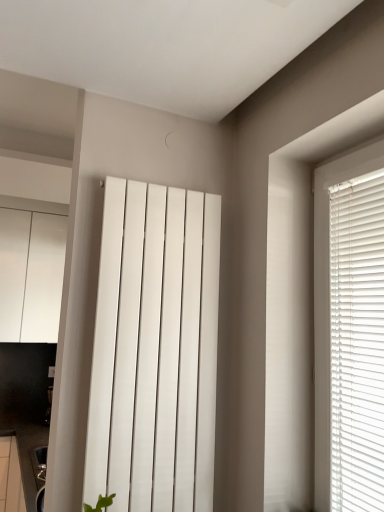
This screenshot has width=384, height=512. What do you see at coordinates (155, 350) in the screenshot?
I see `white smooth radiator at center` at bounding box center [155, 350].

The image size is (384, 512). I want to click on white smooth radiator at center, so click(x=155, y=350).

The width and height of the screenshot is (384, 512). Identify the location of white glossy cabinet at left. (31, 275).

This screenshot has width=384, height=512. Describe the element at coordinates (31, 275) in the screenshot. I see `white glossy cabinet at left` at that location.

Image resolution: width=384 pixels, height=512 pixels. Identify the location of white smooth radiator at center. (155, 350).

Which is more to the right, white glossy cabinet at left or white smooth radiator at center?

white smooth radiator at center is more to the right.

Considering the relative positions of white glossy cabinet at left and white smooth radiator at center in the image provided, is white glossy cabinet at left in front of white smooth radiator at center?

No, it is behind white smooth radiator at center.

Is point (29, 298) farther from camera compared to point (157, 402)?

Yes, point (29, 298) is farther from viewer.

In the scene shown: From the image's perspective, is white glossy cabinet at left under white smooth radiator at center?

No, from the image's perspective, white glossy cabinet at left is not beneath white smooth radiator at center.

From a real-world perspective, which is physically below, white glossy cabinet at left or white smooth radiator at center?

white smooth radiator at center, from a real-world perspective.

Considering the sizes of white glossy cabinet at left and white smooth radiator at center in the image, is white glossy cabinet at left wider or thinner than white smooth radiator at center?

In the image, white glossy cabinet at left appears to be wider than white smooth radiator at center.

Can you confirm if white glossy cabinet at left is taller than white smooth radiator at center?

Correct, white glossy cabinet at left is much taller as white smooth radiator at center.

Looking at this image, between white glossy cabinet at left and white smooth radiator at center, which one has smaller size?

With smaller size is white smooth radiator at center.

Do you think white glossy cabinet at left is within white smooth radiator at center, or outside of it?

white glossy cabinet at left is not inside white smooth radiator at center, it's outside.

Is white glossy cabinet at left next to white smooth radiator at center and touching it?

No, white glossy cabinet at left is not making contact with white smooth radiator at center.

Could you tell me if white glossy cabinet at left is facing white smooth radiator at center?

Yes.

Can you tell me how much white glossy cabinet at left and white smooth radiator at center differ in facing direction?

0.266 degrees.

How much distance is there between white glossy cabinet at left and white smooth radiator at center?

white glossy cabinet at left is 7.13 feet from white smooth radiator at center.

Where is `cabinetry that appears on the left of white smooth radiator at center`? cabinetry that appears on the left of white smooth radiator at center is located at coordinates (31, 275).

Would you say white smooth radiator at center is to the left or to the right of white glossy cabinet at left in the picture?

From the image, it's evident that white smooth radiator at center is to the right of white glossy cabinet at left.

Is white smooth radiator at center in front of or behind white glossy cabinet at left in the image?

white smooth radiator at center is positioned closer to the viewer than white glossy cabinet at left.

Does point (204, 328) lie behind point (15, 212)?

No, it is in front of (15, 212).

From the image's perspective, does white smooth radiator at center appear lower than white glossy cabinet at left?

Yes, from the image's perspective, white smooth radiator at center is beneath white glossy cabinet at left.

From a real-world perspective, who is located higher, white smooth radiator at center or white glossy cabinet at left?

white glossy cabinet at left is physically above.

Which of these two, white smooth radiator at center or white glossy cabinet at left, is wider?

Wider between the two is white glossy cabinet at left.

Which of these two, white smooth radiator at center or white glossy cabinet at left, stands taller?

white glossy cabinet at left.

In the scene shown: Is white smooth radiator at center bigger than white glossy cabinet at left?

Incorrect, white smooth radiator at center is not larger than white glossy cabinet at left.

Is white smooth radiator at center inside or outside of white glossy cabinet at left?

white smooth radiator at center is spatially situated outside white glossy cabinet at left.

Is white smooth radiator at center next to white glossy cabinet at left?

No.

Is white glossy cabinet at left at the back of white smooth radiator at center?

That's right, white smooth radiator at center is facing away from white glossy cabinet at left.

Measure the distance from white smooth radiator at center to white glossy cabinet at left.

A distance of 7.13 feet exists between white smooth radiator at center and white glossy cabinet at left.

The height and width of the screenshot is (512, 384). I want to click on cabinetry to the left of white smooth radiator at center, so click(31, 275).

The width and height of the screenshot is (384, 512). Find the location of `curtain on the right of white glossy cabinet at left`. curtain on the right of white glossy cabinet at left is located at coordinates (155, 350).

Identify the location of cabinetry behind the white smooth radiator at center. The width and height of the screenshot is (384, 512). (31, 275).